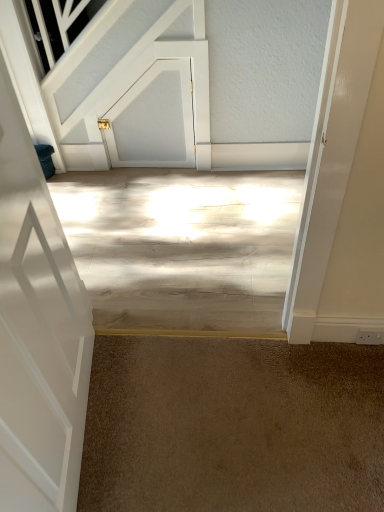
You are a GUI agent. You are given a task and a screenshot of the screen. Output one action in this format:
    pyautogui.click(x=<x>, y=<y>)
    Task: Click on the vacant space to the right of white glossy door at left, acting as the 1th door starting from the bottom
    
    Given the screenshot: What is the action you would take?
    pyautogui.click(x=191, y=419)